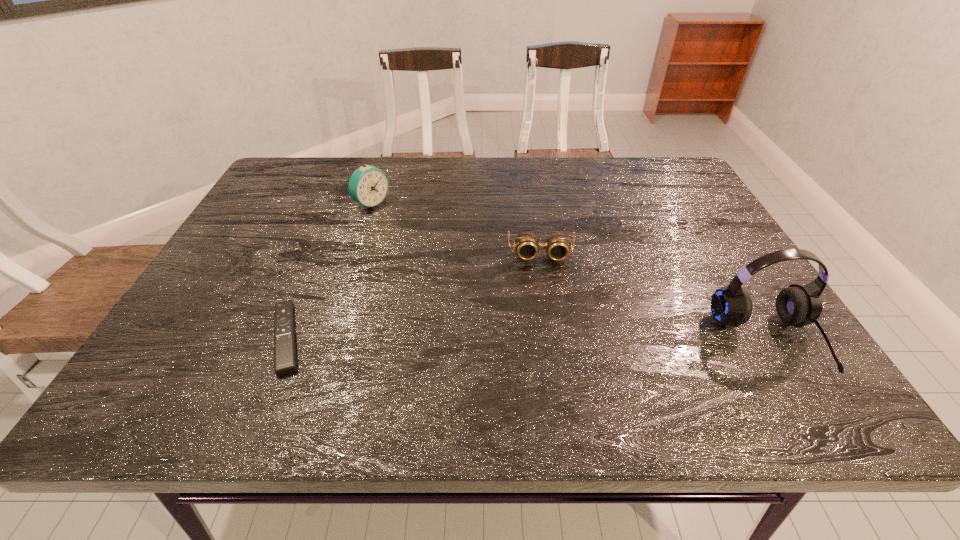
At what (x,y) coordinates should I click in order to perform the action: click on vacant space located on the front-facing side of the alarm clock. Please return your answer as a coordinate pair (x, y). This screenshot has width=960, height=540. Looking at the image, I should click on (422, 237).

Locate an element on the screen. Image resolution: width=960 pixels, height=540 pixels. vacant space situated 0.100m through the lenses of the third nearest object is located at coordinates (544, 294).

Locate an element on the screen. The image size is (960, 540). free space located 0.170m through the lenses of the third nearest object is located at coordinates (547, 317).

The width and height of the screenshot is (960, 540). Identify the location of vacant region located 0.300m through the lenses of the third nearest object. (552, 367).

You are a GUI agent. You are given a task and a screenshot of the screen. Output one action in this format:
    pyautogui.click(x=<x>, y=<y>)
    Task: Click on the object at the far edge
    The height and width of the screenshot is (540, 960).
    Given the screenshot: What is the action you would take?
    pyautogui.click(x=368, y=185)

You are a GUI agent. You are given a task and a screenshot of the screen. Output one action in this format:
    pyautogui.click(x=<x>, y=<y>)
    Task: Click on the remote control present at the near edge
    
    Given the screenshot: What is the action you would take?
    pyautogui.click(x=285, y=362)

Locate an element on the screen. Image resolution: width=960 pixels, height=540 pixels. headset that is at the near edge is located at coordinates (796, 305).

Identify the location of object that is at the right edge. (796, 305).

The height and width of the screenshot is (540, 960). I want to click on object positioned at the near right corner, so click(796, 305).

Where is `vacant space at the far edge of the desktop`? The height and width of the screenshot is (540, 960). vacant space at the far edge of the desktop is located at coordinates (357, 162).